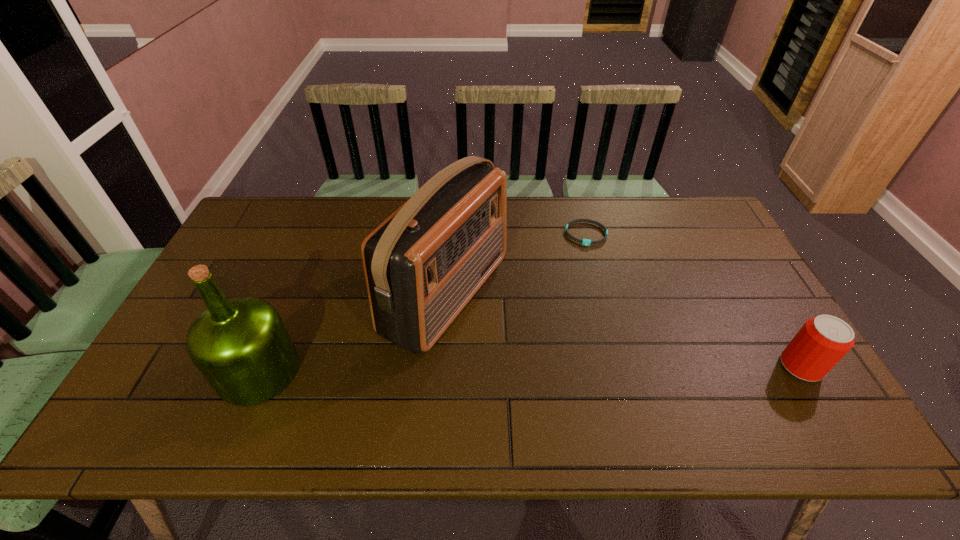
The image size is (960, 540). I want to click on object present at the near right corner, so click(x=822, y=342).

Find the location of a particular element. free space at the far edge is located at coordinates (317, 212).

Identify the location of free spot at the near edge of the desktop. This screenshot has width=960, height=540. tap(540, 380).

In the image, there is a desktop. At what (x,y) coordinates should I click in order to perform the action: click on vacant space at the left edge. Please return your answer as a coordinate pair (x, y). Image resolution: width=960 pixels, height=540 pixels. Looking at the image, I should click on (275, 244).

Locate an element on the screen. The width and height of the screenshot is (960, 540). vacant space at the right edge of the desktop is located at coordinates (758, 363).

You are a GUI agent. You are given a task and a screenshot of the screen. Output one action in this format:
    pyautogui.click(x=<x>, y=<y>)
    Task: Click on the vacant position at the far left corner of the desktop
    
    Given the screenshot: What is the action you would take?
    pyautogui.click(x=256, y=200)

The image size is (960, 540). I want to click on unoccupied position between the leftmost object and the second object from left to right, so click(x=352, y=333).

At what (x,y) coordinates should I click in order to perform the action: click on vacant space in between the radio receiver and the shortest object. Please return your answer as a coordinate pair (x, y). This screenshot has width=960, height=540. Looking at the image, I should click on [x=516, y=265].

Locate an element on the screen. The height and width of the screenshot is (540, 960). free space between the rightmost object and the olive oil is located at coordinates (530, 369).

Image resolution: width=960 pixels, height=540 pixels. Find the location of `free space between the leftmost object and the radio receiver`. free space between the leftmost object and the radio receiver is located at coordinates (352, 333).